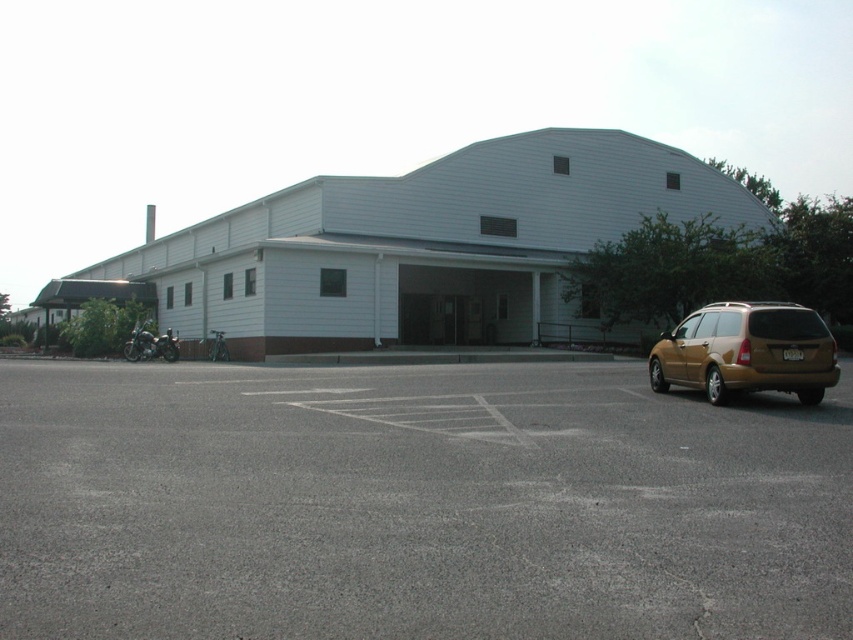
How distant is gray asphalt parking lot at center from gold metallic suv at right?

gray asphalt parking lot at center is 5.47 meters away from gold metallic suv at right.

Locate an element on the screen. gray asphalt parking lot at center is located at coordinates (416, 504).